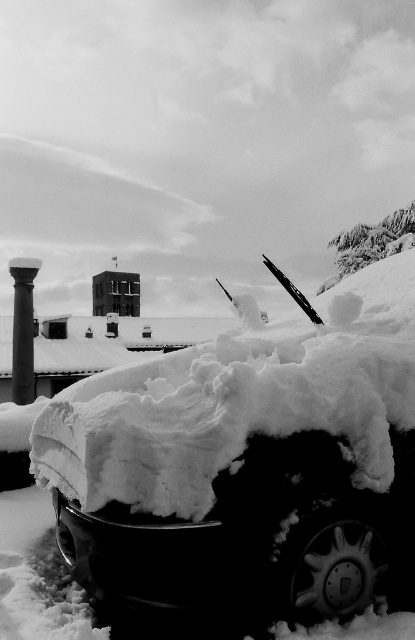
You are a photographer who wants to capture the contrast between the white fluffy snow at center and the smooth black column at left. Based on the scene description, which object would appear lighter in the photograph?

The white fluffy snow at center would appear lighter in the photograph because it is described as being thinner than the smooth black column at left, allowing more light to reflect off its surface.

You are standing in the snowy scene and want to place a small red flag on the highest point between the white fluffy snow at center and the smooth black column at left. Which location should you choose?

The white fluffy snow at center is located above the smooth black column at left, so you should place the small red flag on the white fluffy snow at center as it is the higher point between the two.

You are a photographer who wants to capture the contrast between the white fluffy snow at center and the smooth black column at left. Which object takes up more area in the photo?

The smooth black column at left occupies more space than the white fluffy snow at center in the photo.